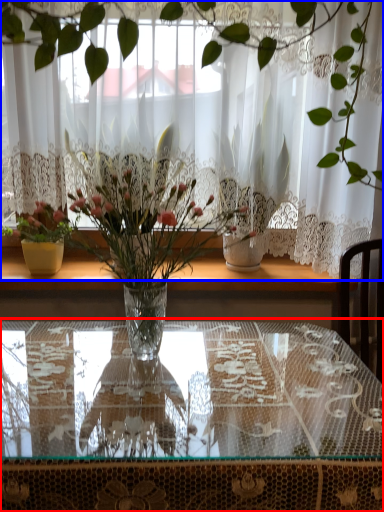
Question: Which point is closer to the camera, table (highlighted by a red box) or curtain (highlighted by a blue box)?

Choices:
 (A) table
 (B) curtain

Answer: (A)